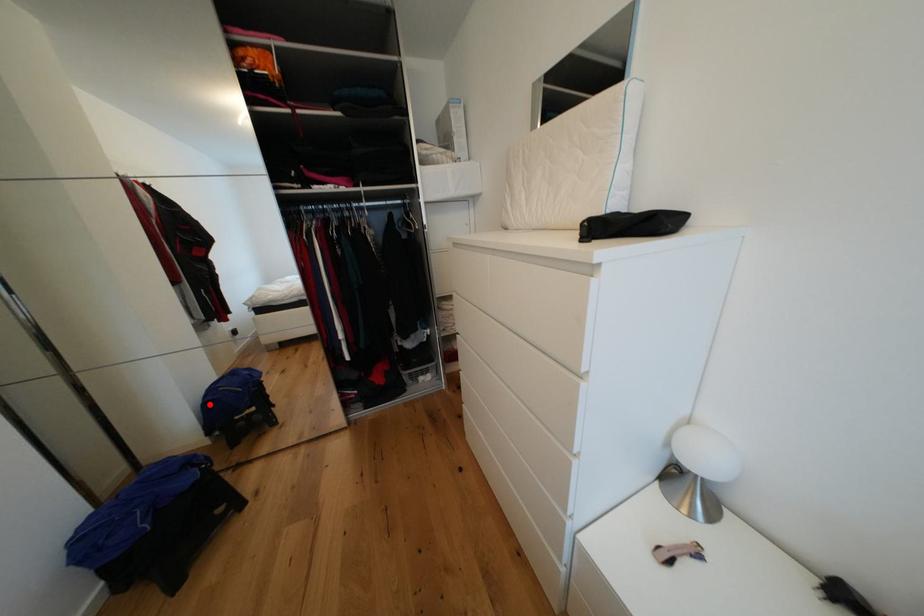
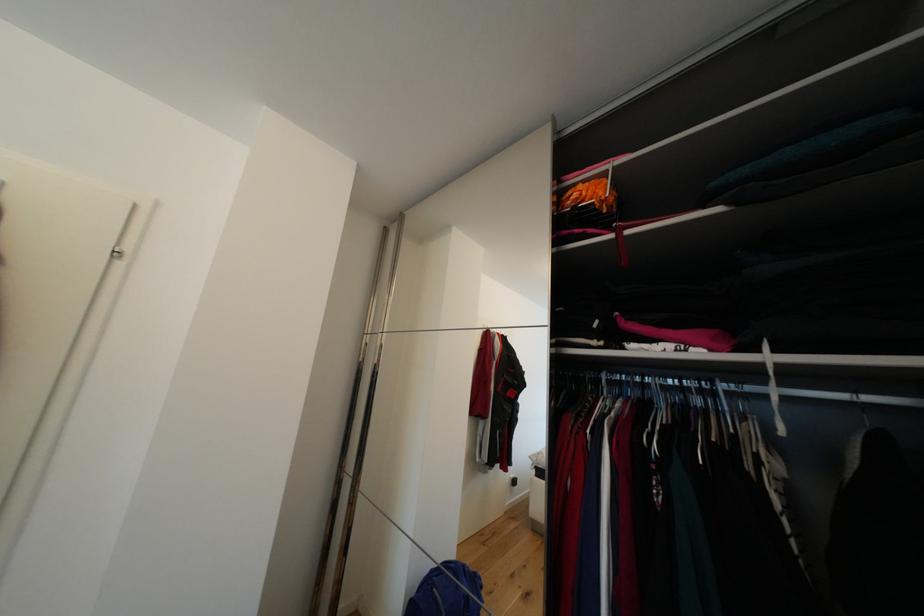
In the second image, find the point that corresponds to the highlighted location in the first image.

(421, 592)